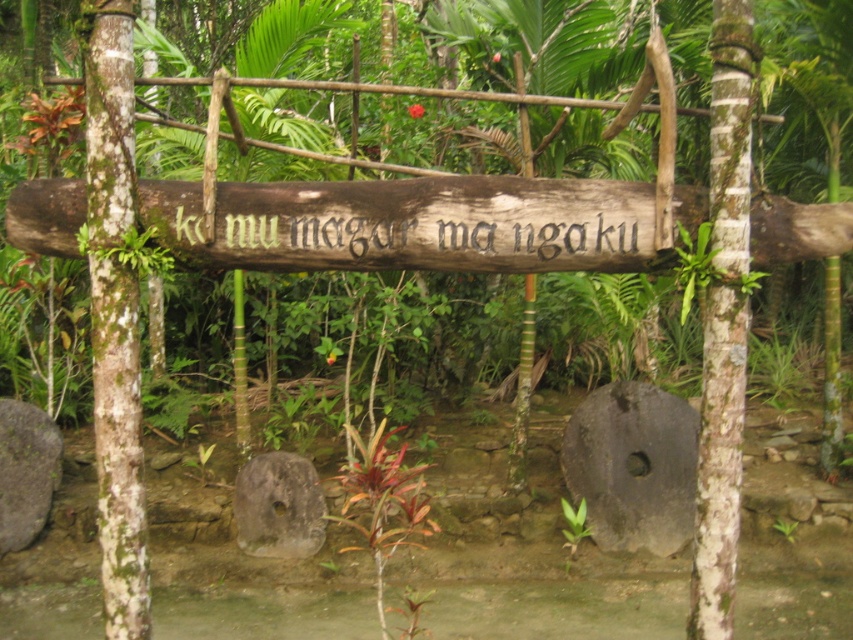
Question: Which object is positioned closest to the dark gray stone at lower right?

Choices:
 (A) brown wooden sign at center
 (B) green mossy tree trunk at left
 (C) gray rough stone at lower left
 (D) gray rough stone at center

Answer: (D)

Question: Considering the relative positions of gray rough stone at center and gray rough stone at lower left in the image provided, where is gray rough stone at center located with respect to gray rough stone at lower left?

Choices:
 (A) left
 (B) right

Answer: (B)

Question: Which point is farther to the camera?

Choices:
 (A) (103, 99)
 (B) (273, 531)

Answer: (B)

Question: Can you confirm if brown wooden sign at center is bigger than green mossy tree trunk at left?

Choices:
 (A) no
 (B) yes

Answer: (B)

Question: Does gray rough stone at center come behind gray rough stone at lower left?

Choices:
 (A) no
 (B) yes

Answer: (B)

Question: Which point is closer to the camera taking this photo?

Choices:
 (A) (20, 520)
 (B) (115, 29)
 (C) (604, 536)
 (D) (318, 538)

Answer: (B)